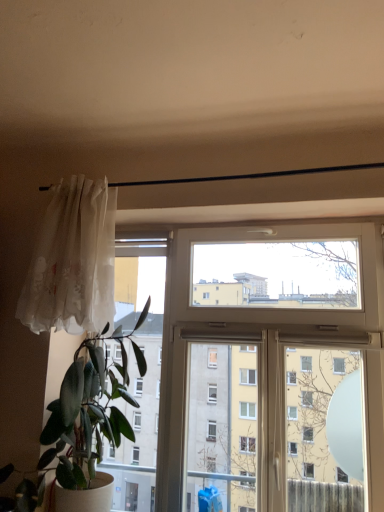
Question: Can you confirm if white plastic window at center is taller than translucent white curtain at left?

Choices:
 (A) no
 (B) yes

Answer: (B)

Question: Is white plastic window at center wider than translucent white curtain at left?

Choices:
 (A) yes
 (B) no

Answer: (B)

Question: Is white plastic window at center at the right side of translucent white curtain at left?

Choices:
 (A) no
 (B) yes

Answer: (B)

Question: From a real-world perspective, is white plastic window at center below translucent white curtain at left?

Choices:
 (A) yes
 (B) no

Answer: (A)

Question: Is translucent white curtain at left located within white plastic window at center?

Choices:
 (A) no
 (B) yes

Answer: (A)

Question: Could you tell me if white plastic window at center is turned towards translucent white curtain at left?

Choices:
 (A) no
 (B) yes

Answer: (B)

Question: Can you confirm if translucent white curtain at left is wider than white plastic window at center?

Choices:
 (A) no
 (B) yes

Answer: (B)

Question: Can you confirm if translucent white curtain at left is positioned to the right of white plastic window at center?

Choices:
 (A) no
 (B) yes

Answer: (A)

Question: Does translucent white curtain at left turn towards white plastic window at center?

Choices:
 (A) yes
 (B) no

Answer: (B)

Question: Does translucent white curtain at left appear on the left side of white plastic window at center?

Choices:
 (A) no
 (B) yes

Answer: (B)

Question: Is translucent white curtain at left placed right next to white plastic window at center?

Choices:
 (A) no
 (B) yes

Answer: (A)

Question: Is the depth of translucent white curtain at left less than that of white plastic window at center?

Choices:
 (A) no
 (B) yes

Answer: (A)

Question: Could you tell me if translucent white curtain at left is facing green matte plant at left?

Choices:
 (A) no
 (B) yes

Answer: (A)